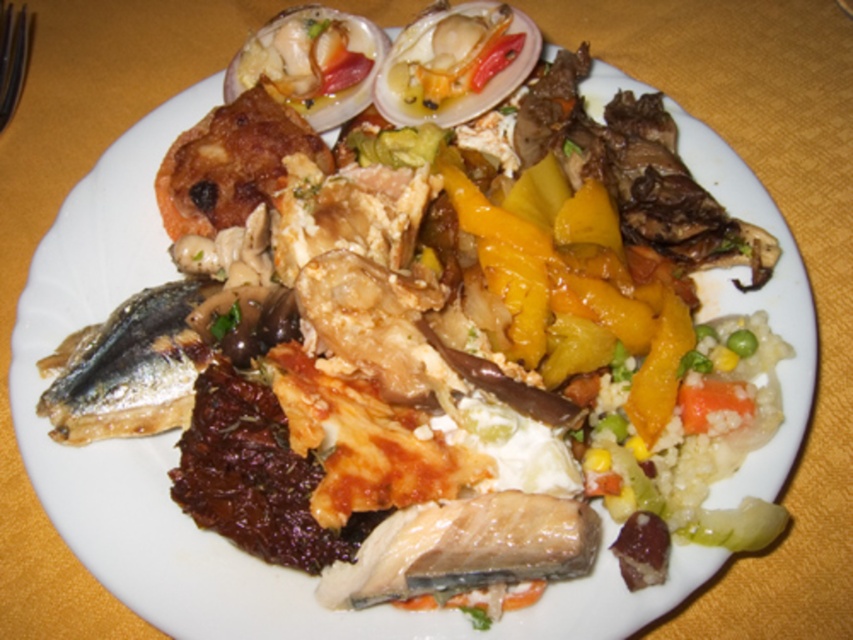
Does shiny silver fish at left have a lesser height compared to shiny white shellfish at upper center?

No, shiny silver fish at left is not shorter than shiny white shellfish at upper center.

The height and width of the screenshot is (640, 853). Identify the location of shiny silver fish at left. (128, 369).